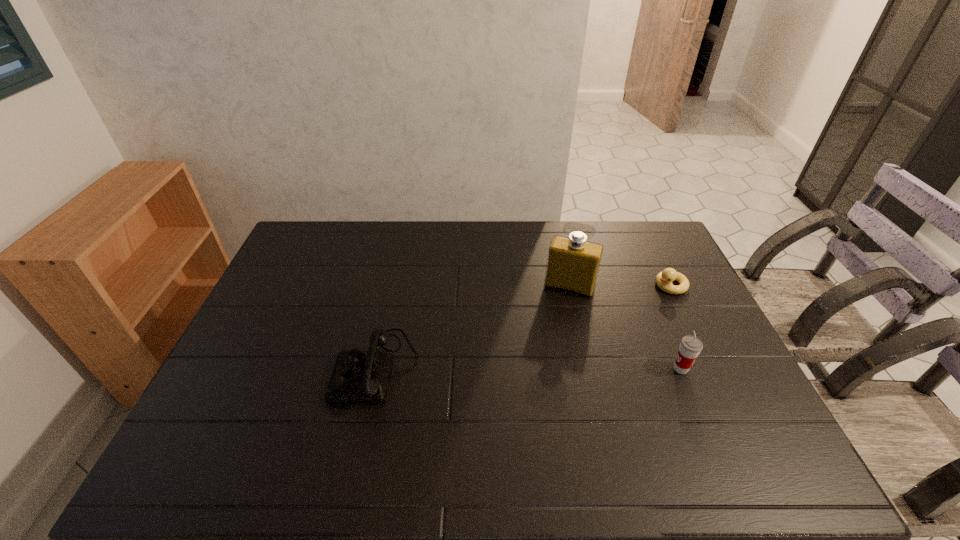
Locate an element on the screen. The height and width of the screenshot is (540, 960). free space located on the side of the cup with the logo is located at coordinates (593, 369).

Locate an element on the screen. free spot located on the side of the cup with the logo is located at coordinates (590, 369).

Locate an element on the screen. The image size is (960, 540). free location located on the front-facing side of the tallest object is located at coordinates (540, 373).

I want to click on vacant point located 0.140m on the front-facing side of the tallest object, so click(x=553, y=329).

Locate an element on the screen. Image resolution: width=960 pixels, height=540 pixels. blank space located on the front-facing side of the tallest object is located at coordinates (543, 362).

Image resolution: width=960 pixels, height=540 pixels. What are the coordinates of `vacant space located at the beak of the shortest object` in the screenshot? It's located at (618, 312).

This screenshot has height=540, width=960. I want to click on vacant position located at the beak of the shortest object, so click(632, 305).

Identify the location of vacant space located 0.180m at the beak of the shortest object. This screenshot has height=540, width=960. (618, 312).

Where is `object situated at the near edge`? The height and width of the screenshot is (540, 960). object situated at the near edge is located at coordinates (359, 377).

At what (x,y) coordinates should I click in order to perform the action: click on cup at the right edge. Please return your answer as a coordinate pair (x, y). Looking at the image, I should click on (690, 347).